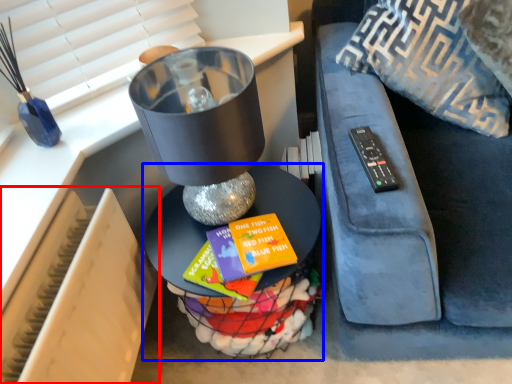
Question: Which point is further to the camera, radiator (highlighted by a red box) or table (highlighted by a blue box)?

Choices:
 (A) radiator
 (B) table

Answer: (B)